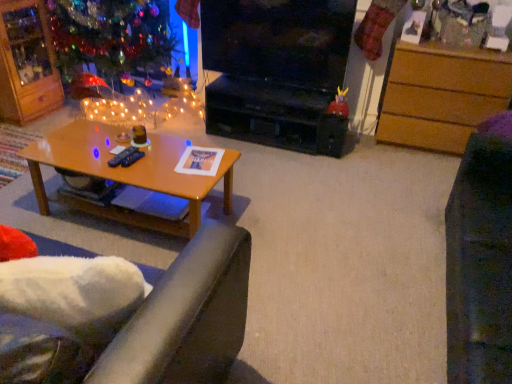
Where is `vacant space underneath black glossy television at center (from a real-world perspective)`? This screenshot has width=512, height=384. vacant space underneath black glossy television at center (from a real-world perspective) is located at coordinates (268, 83).